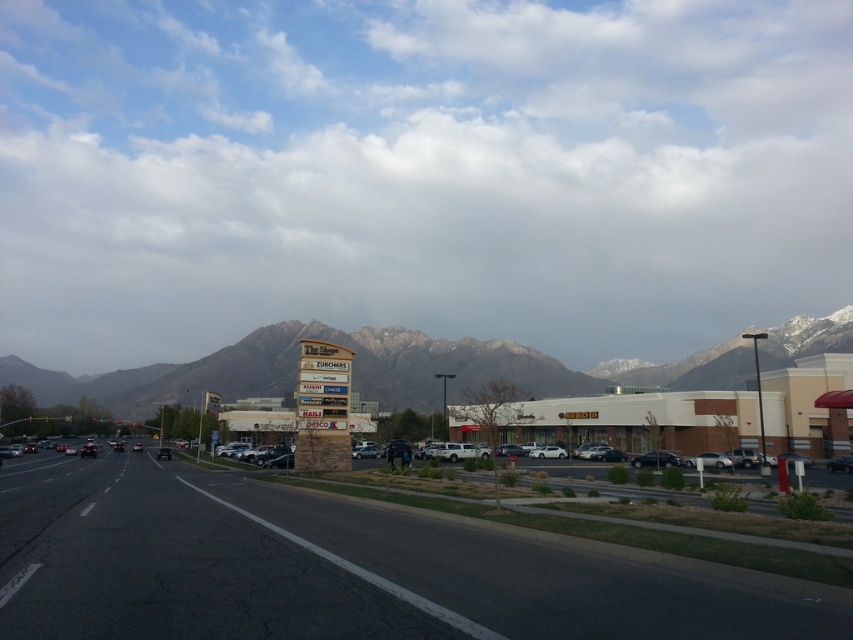
Looking at this image, is white fluffy cloud at upper center positioned in front of rocky mountain range at center?

That is False.

Who is positioned more to the right, white fluffy cloud at upper center or rocky mountain range at center?

rocky mountain range at center is more to the right.

Measure the distance between white fluffy cloud at upper center and camera.

white fluffy cloud at upper center is 770.19 feet away from camera.

At what (x,y) coordinates should I click in order to perform the action: click on white fluffy cloud at upper center. Please return your answer as a coordinate pair (x, y). The height and width of the screenshot is (640, 853). Looking at the image, I should click on (419, 172).